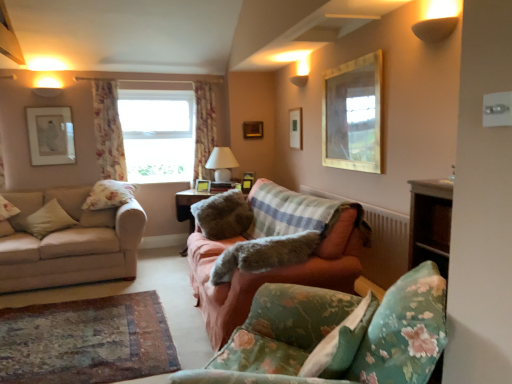
Locate an element on the screen. blank space situated above rug at lower left (from a real-world perspective) is located at coordinates (66, 336).